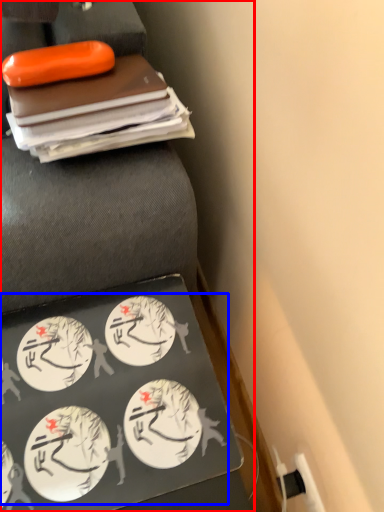
Question: Among these objects, which one is nearest to the camera, furniture (highlighted by a red box) or food (highlighted by a blue box)?

Choices:
 (A) furniture
 (B) food

Answer: (A)